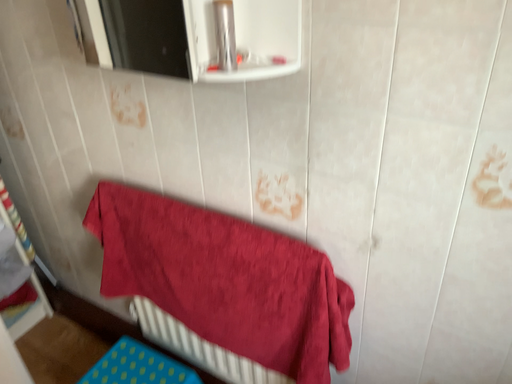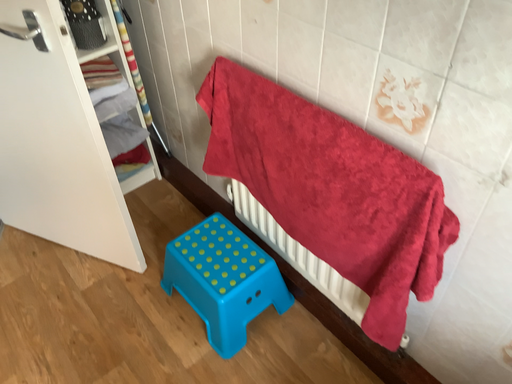
Question: How did the camera likely rotate when shooting the video?

Choices:
 (A) rotated downward
 (B) rotated upward

Answer: (A)